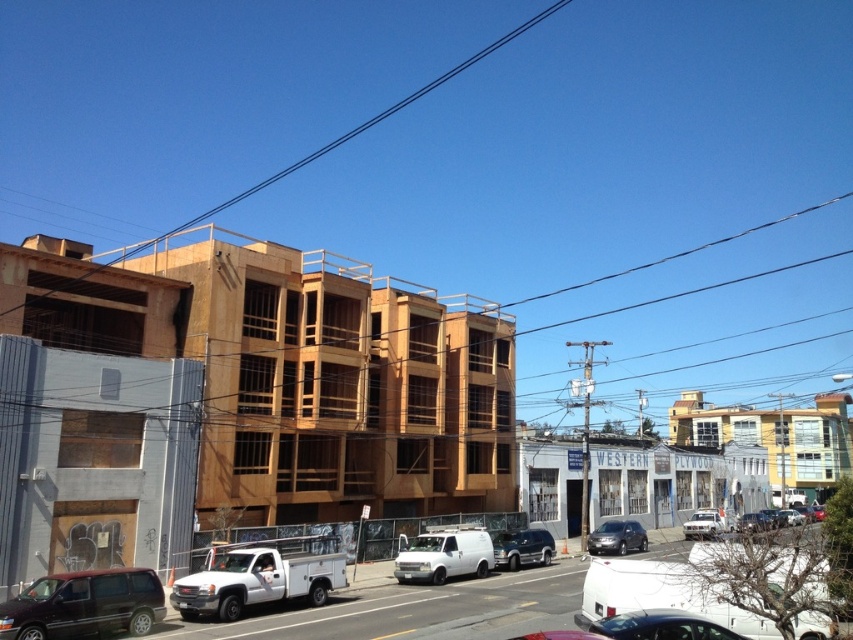
You are standing in the urban street scene and want to determine the relative positions of two points marked in the image. Which point, point 1 at coordinates [459,538] or point 2 at [706,534], is closer to you?

Point 1 at coordinates [459,538] is closer to you than point 2 at [706,534].